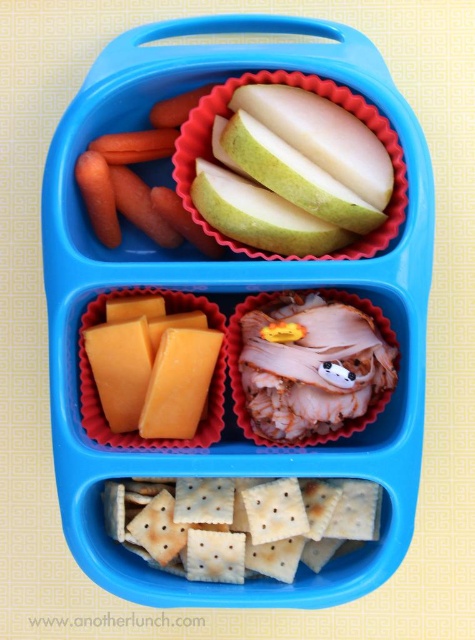
Question: Does orange hard cheese at lower left appear on the left side of orange smooth carrot at upper left?

Choices:
 (A) no
 (B) yes

Answer: (B)

Question: Which point appears farthest from the camera in this image?

Choices:
 (A) (180, 368)
 (B) (163, 212)

Answer: (B)

Question: Observing the image, what is the correct spatial positioning of orange hard cheese at lower left in reference to orange smooth carrot at upper left?

Choices:
 (A) above
 (B) below

Answer: (B)

Question: Is orange hard cheese at lower left to the left of orange smooth carrot at upper left from the viewer's perspective?

Choices:
 (A) yes
 (B) no

Answer: (A)